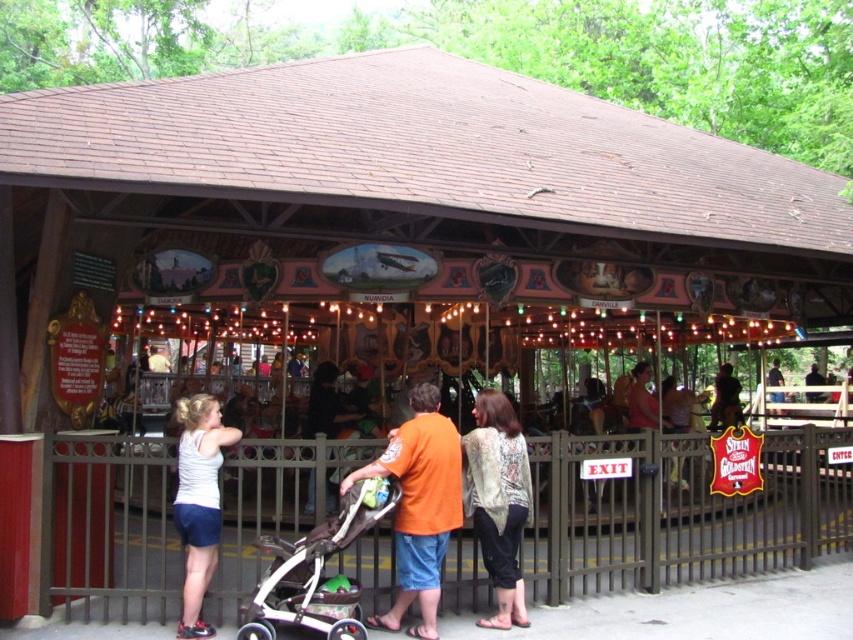
Between black plastic baby carriage at center and floral lace blouse at center, which one is positioned lower?

black plastic baby carriage at center

Does black plastic baby carriage at center appear on the right side of floral lace blouse at center?

Incorrect, black plastic baby carriage at center is not on the right side of floral lace blouse at center.

Between point (281, 573) and point (531, 508), which one is positioned in front?

Point (281, 573) is in front.

In order to click on black plastic baby carriage at center in this screenshot , I will do [316, 570].

Which is more to the right, orange cotton shirt at center or black plastic baby carriage at center?

From the viewer's perspective, orange cotton shirt at center appears more on the right side.

Who is more distant from viewer, (428, 557) or (364, 515)?

Positioned behind is point (428, 557).

The width and height of the screenshot is (853, 640). I want to click on orange cotton shirt at center, so click(x=419, y=506).

Consider the image. Which is above, floral lace blouse at center or white matte tank top at center?

Positioned higher is white matte tank top at center.

How far apart are floral lace blouse at center and white matte tank top at center?

1.97 meters

Which is behind, point (498, 532) or point (189, 493)?

Positioned behind is point (498, 532).

Identify the location of floral lace blouse at center. This screenshot has height=640, width=853. (498, 500).